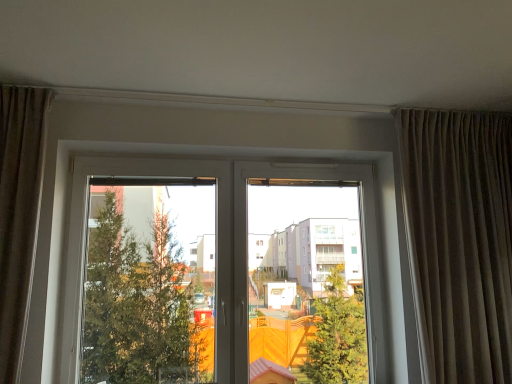
Question: From the image's perspective, is brown textured curtain at right above or below transparent glass window at center?

Choices:
 (A) below
 (B) above

Answer: (B)

Question: From a real-world perspective, relative to transparent glass window at center, is brown textured curtain at right vertically above or below?

Choices:
 (A) below
 (B) above

Answer: (B)

Question: In the image, is brown textured curtain at right positioned in front of or behind transparent glass window at center?

Choices:
 (A) behind
 (B) front

Answer: (B)

Question: Is transparent glass window at center in front of or behind brown textured curtain at right in the image?

Choices:
 (A) behind
 (B) front

Answer: (A)

Question: Looking at their shapes, would you say transparent glass window at center is wider or thinner than brown textured curtain at right?

Choices:
 (A) wide
 (B) thin

Answer: (B)

Question: From the image's perspective, is transparent glass window at center positioned above or below brown textured curtain at right?

Choices:
 (A) above
 (B) below

Answer: (B)

Question: From their relative heights in the image, would you say transparent glass window at center is taller or shorter than brown textured curtain at right?

Choices:
 (A) short
 (B) tall

Answer: (A)